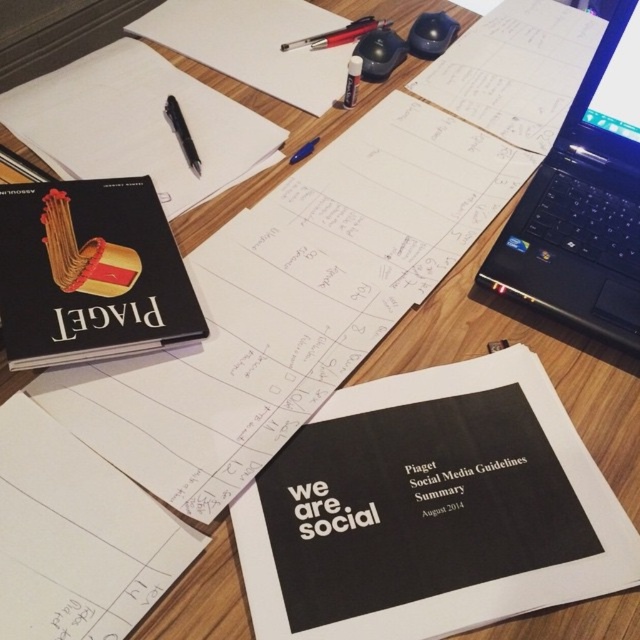
Which is in front, point (372, 77) or point (352, 99)?

Positioned in front is point (352, 99).

Locate an element on the screen. matte black mouse at upper center is located at coordinates click(x=380, y=52).

You are a GUI agent. You are given a task and a screenshot of the screen. Output one action in this format:
    pyautogui.click(x=<x>, y=<y>)
    Task: Click on the matte black mouse at upper center
    
    Given the screenshot: What is the action you would take?
    pyautogui.click(x=380, y=52)

Is point (586, 298) more distant than point (186, 160)?

No, it is not.

Between black plastic laptop at upper right and black plastic pen at upper left, which one has less height?

black plastic pen at upper left is shorter.

Does point (592, 264) come behind point (176, 129)?

No.

Identify the location of black plastic laptop at upper right. tap(584, 202).

In the scene shown: Is black paper at center below metallic pen at upper center?

Correct, black paper at center is located below metallic pen at upper center.

Is black paper at center smaller than metallic pen at upper center?

No, black paper at center is not smaller than metallic pen at upper center.

This screenshot has height=640, width=640. In order to click on black paper at center in this screenshot , I will do `click(429, 509)`.